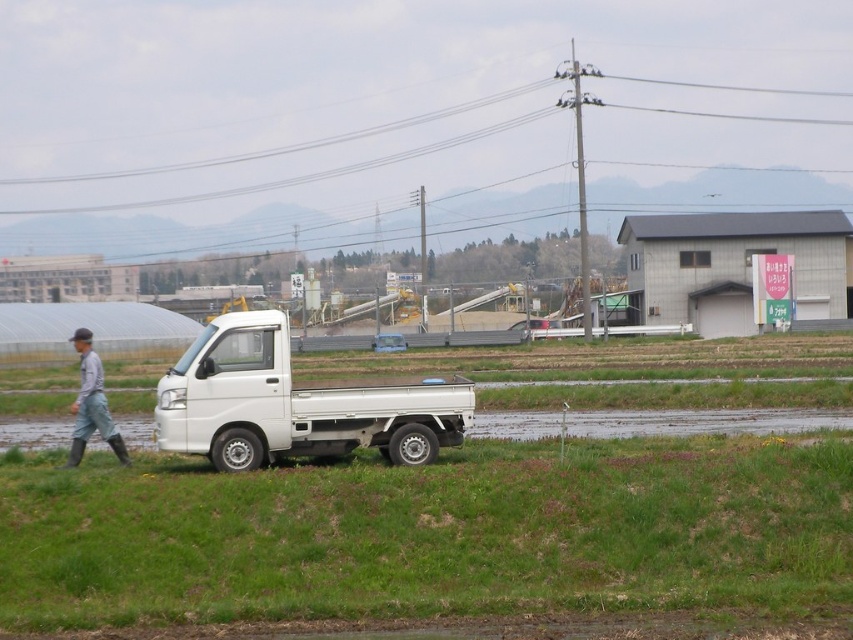
You are standing in the field and see the white matte truck at center and the gray fabric pants at left. Which object is higher in the image?

The white matte truck at center is higher than the gray fabric pants at left in the image.

Looking at this image, you are standing in the rural field and see the green grass at lower center and the gray fabric pants at left. Which object is positioned to the right of the other?

The green grass at lower center is positioned to the right of the gray fabric pants at left.

You are standing at the edge of the grassy field and see the green grass at lower center and the white matte truck at center. Which object is closer to you?

The green grass at lower center is closer to you because it is positioned under the white matte truck at center, indicating it is in a lower, more forward position.